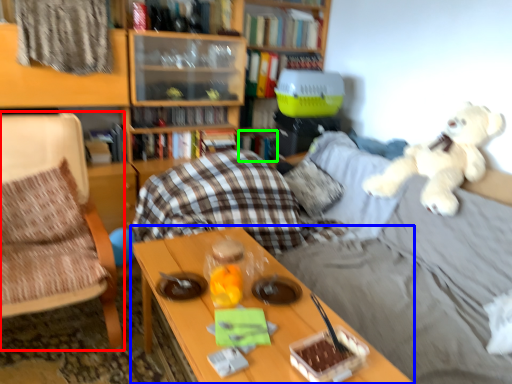
Question: Considering the real-world distances, which object is closest to chair (highlighted by a red box)? table (highlighted by a blue box) or book (highlighted by a green box).

Choices:
 (A) table
 (B) book

Answer: (A)